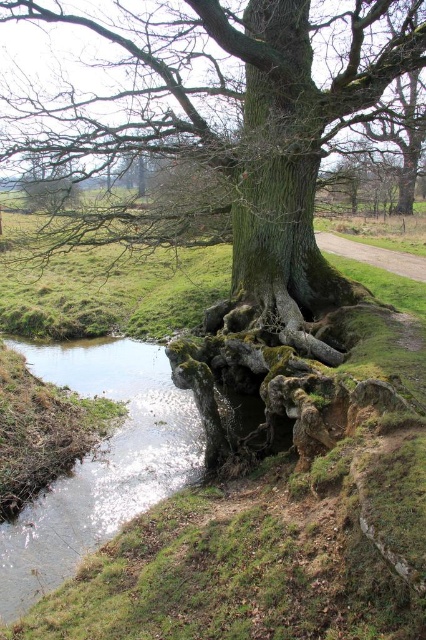
Question: Is clear water at lower left to the left of green rough bark tree trunk at center from the viewer's perspective?

Choices:
 (A) no
 (B) yes

Answer: (B)

Question: Which object is positioned farthest from the green rough bark tree at center?

Choices:
 (A) clear water at lower left
 (B) green rough bark tree trunk at center

Answer: (A)

Question: Can you confirm if green rough bark tree at center is positioned below green rough bark tree trunk at center?

Choices:
 (A) yes
 (B) no

Answer: (B)

Question: Is green rough bark tree at center below green rough bark tree trunk at center?

Choices:
 (A) yes
 (B) no

Answer: (B)

Question: Which point is closer to the camera?

Choices:
 (A) green rough bark tree at center
 (B) clear water at lower left
 (C) green rough bark tree trunk at center

Answer: (B)

Question: Which point is farther from the camera taking this photo?

Choices:
 (A) (100, 234)
 (B) (245, 237)

Answer: (A)